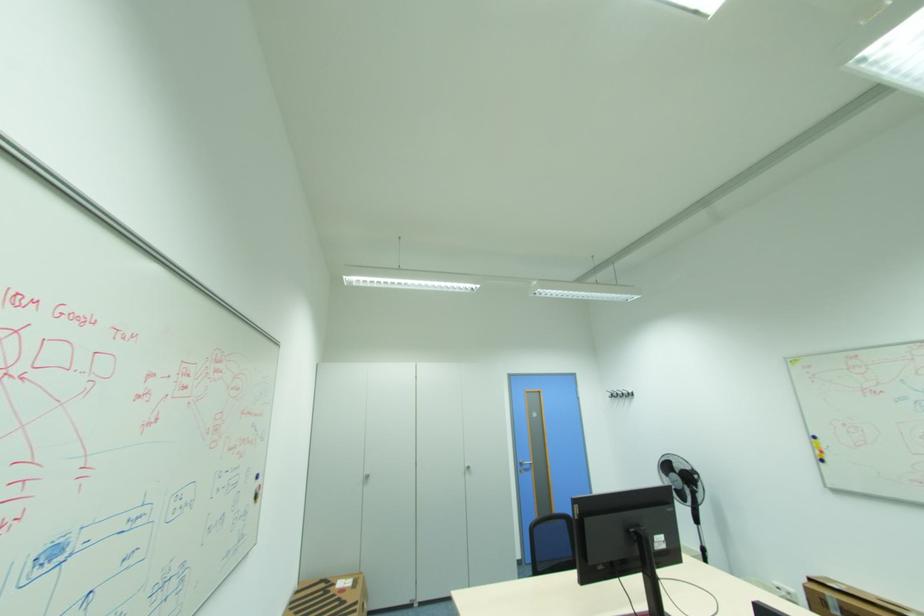
This screenshot has height=616, width=924. What do you see at coordinates (619, 394) in the screenshot? I see `a black wall hook` at bounding box center [619, 394].